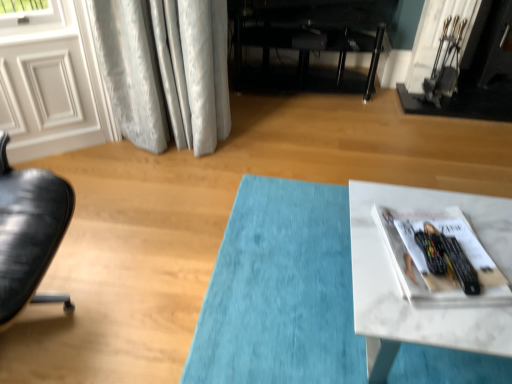
Locate an element on the screen. vacant space situated above white marble table at lower right (from a real-world perspective) is located at coordinates (448, 251).